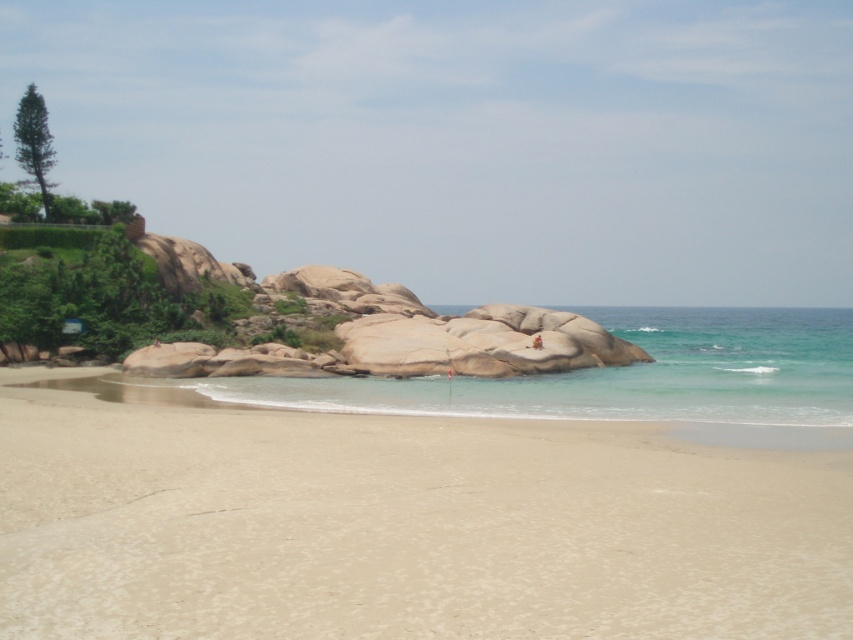
You are standing on the beach and see the point marked at coordinates (403, 525). Based on the scene description, what type of terrain would you expect to find there?

The point at (403, 525) marks smooth sand at center, so you would expect to find smooth sand terrain there.

You are standing on the beach and want to walk from the smooth sand at center to the clear blue water at center. Which direction should you move to reach the water?

The smooth sand at center is not as tall as clear blue water at center, so you should move towards the direction where the clear blue water at center is lower than the smooth sand at center. However, since water is typically lower than sand in beach scenes, you would naturally walk towards the clear blue water at center in the direction of the shoreline.

You are standing at the origin point of the coordinate system in the image. Which direction should you move to reach the smooth sand at center?

The smooth sand at center is located at coordinate point 0.822 on the x axis and 0.474 on the y axis. Since you are at the origin, you should move towards the positive x and positive y directions to reach it.